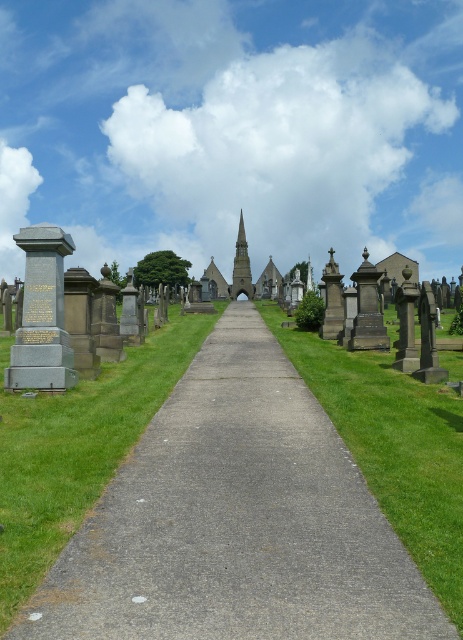
Question: Does gray concrete pavement at center have a smaller size compared to smooth gray spire at center?

Choices:
 (A) yes
 (B) no

Answer: (A)

Question: Can you confirm if gray concrete pavement at center is thinner than smooth gray spire at center?

Choices:
 (A) yes
 (B) no

Answer: (A)

Question: Does gray concrete pavement at center appear on the left side of smooth gray spire at center?

Choices:
 (A) no
 (B) yes

Answer: (B)

Question: Which object is closer to the camera taking this photo?

Choices:
 (A) smooth gray spire at center
 (B) gray concrete pavement at center

Answer: (B)

Question: Which object appears farthest from the camera in this image?

Choices:
 (A) gray concrete pavement at center
 (B) smooth gray spire at center

Answer: (B)